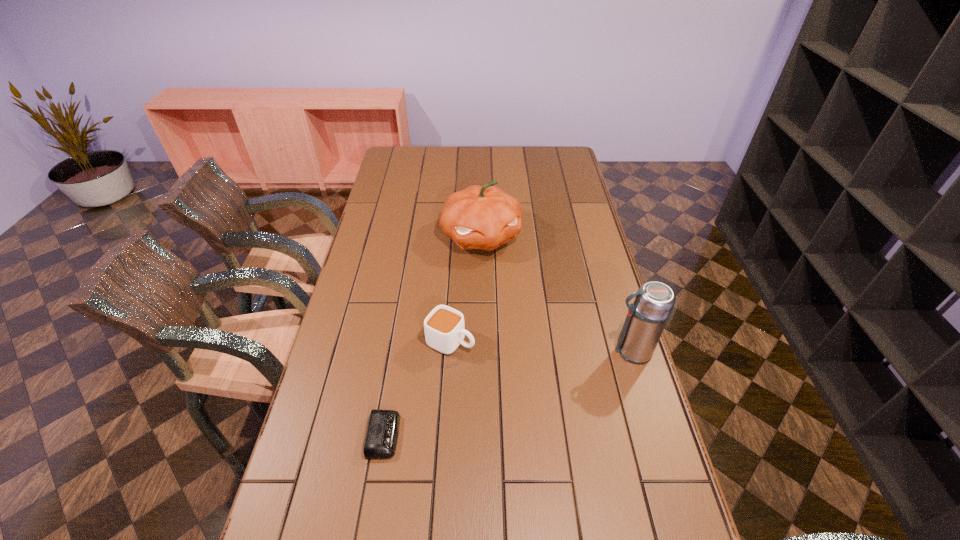
Choose which object is the second nearest neighbor to the thermos bottle. Please provide its 2D coordinates. Your answer should be formatted as a tuple, i.e. [(x, y)], where the tuple contains the x and y coordinates of a point satisfying the conditions above.

[(485, 217)]

You are a GUI agent. You are given a task and a screenshot of the screen. Output one action in this format:
    pyautogui.click(x=<x>, y=<y>)
    Task: Click on the vacant space that satisfies the following two spatial constraints: 1. on the front side of the rightmost object; 2. with a handle on the side of the farthest object
    This screenshot has width=960, height=540.
    Given the screenshot: What is the action you would take?
    pyautogui.click(x=482, y=351)

Find the location of a particular element. This screenshot has width=960, height=540. vacant space that satisfies the following two spatial constraints: 1. on the front side of the cup; 2. with a handle on the side of the thermos bottle is located at coordinates (450, 351).